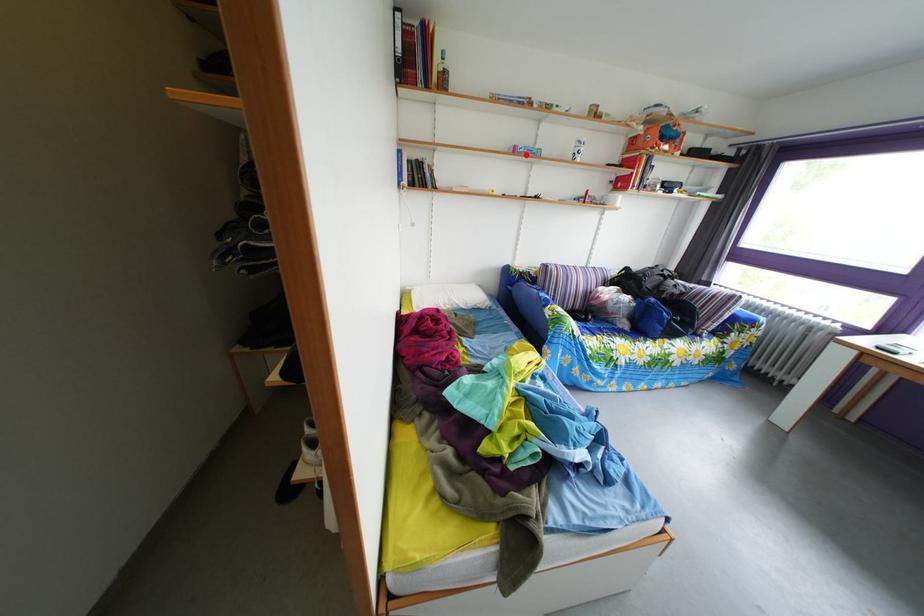
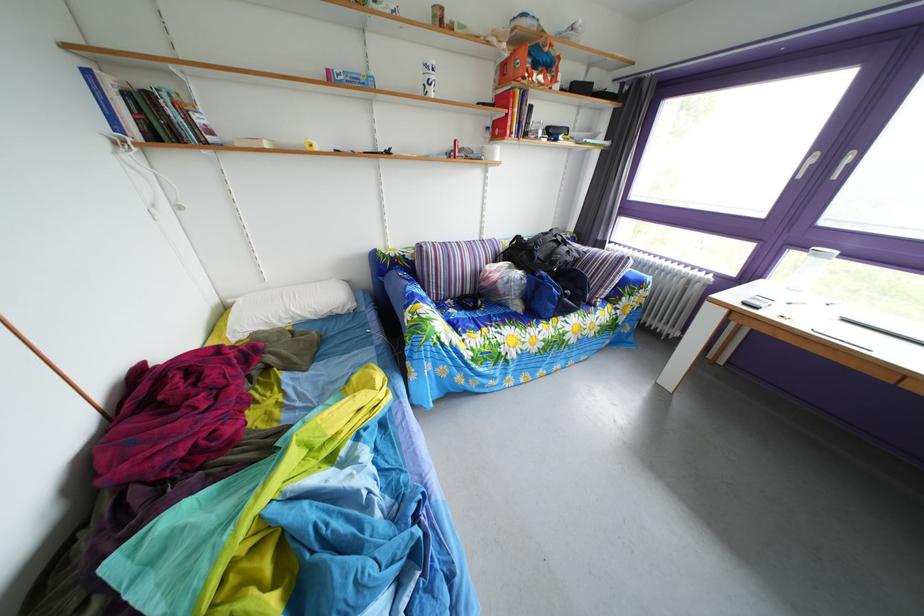
In the second image, find the point that corresponds to the highlighted location in the first image.

(339, 79)